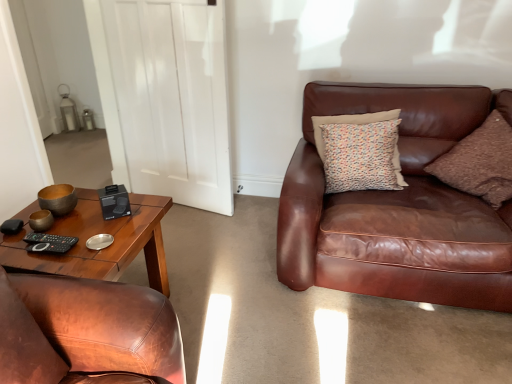
You are a GUI agent. You are given a task and a screenshot of the screen. Output one action in this format:
    pyautogui.click(x=<x>, y=<y>)
    Task: Click on the free space above brown leather chair at left (from a real-world perspective)
    The image size is (512, 384).
    Given the screenshot: What is the action you would take?
    pyautogui.click(x=67, y=235)